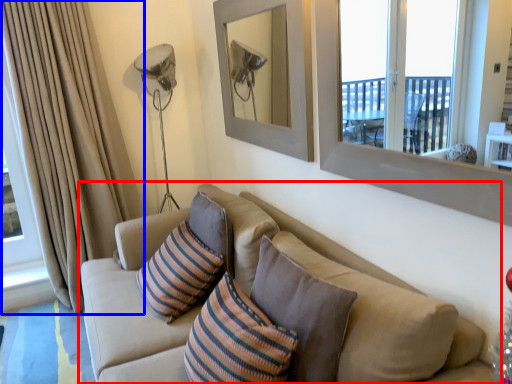
Question: Which object is further to the camera taking this photo, studio couch (highlighted by a red box) or curtain (highlighted by a blue box)?

Choices:
 (A) studio couch
 (B) curtain

Answer: (B)